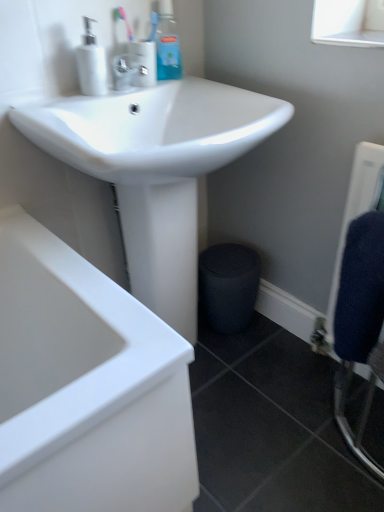
Question: Is white glossy soap dispenser at upper left taller than satin nickel faucet at upper center, placed as the 1th toiletry when sorted from left to right?

Choices:
 (A) yes
 (B) no

Answer: (A)

Question: Is white glossy soap dispenser at upper left facing away from satin nickel faucet at upper center, which appears as the 2th toiletry when viewed from the right?

Choices:
 (A) no
 (B) yes

Answer: (A)

Question: From the image's perspective, is white glossy soap dispenser at upper left on top of satin nickel faucet at upper center, placed as the 1th toiletry when sorted from left to right?

Choices:
 (A) yes
 (B) no

Answer: (B)

Question: From a real-world perspective, does white glossy soap dispenser at upper left sit lower than satin nickel faucet at upper center, which appears as the 2th toiletry when viewed from the right?

Choices:
 (A) yes
 (B) no

Answer: (B)

Question: Is white glossy soap dispenser at upper left aimed at satin nickel faucet at upper center, placed as the 1th toiletry when sorted from left to right?

Choices:
 (A) yes
 (B) no

Answer: (B)

Question: Is white glossy soap dispenser at upper left to the left of satin nickel faucet at upper center, which appears as the 2th toiletry when viewed from the right, from the viewer's perspective?

Choices:
 (A) yes
 (B) no

Answer: (A)

Question: From the image's perspective, is satin nickel faucet at upper center, which appears as the 2th toiletry when viewed from the right, located above dark blue textured towel at right?

Choices:
 (A) yes
 (B) no

Answer: (A)

Question: Is satin nickel faucet at upper center, placed as the 1th toiletry when sorted from left to right, far away from dark blue textured towel at right?

Choices:
 (A) yes
 (B) no

Answer: (B)

Question: Does satin nickel faucet at upper center, which appears as the 2th toiletry when viewed from the right, have a smaller size compared to dark blue textured towel at right?

Choices:
 (A) yes
 (B) no

Answer: (A)

Question: From a real-world perspective, is satin nickel faucet at upper center, placed as the 1th toiletry when sorted from left to right, over dark blue textured towel at right?

Choices:
 (A) yes
 (B) no

Answer: (A)

Question: Is dark blue textured towel at right located within satin nickel faucet at upper center, placed as the 1th toiletry when sorted from left to right?

Choices:
 (A) no
 (B) yes

Answer: (A)

Question: Could you tell me if satin nickel faucet at upper center, placed as the 1th toiletry when sorted from left to right, is facing dark blue textured towel at right?

Choices:
 (A) yes
 (B) no

Answer: (B)

Question: Is white glossy sink at upper center located outside dark blue textured towel at right?

Choices:
 (A) yes
 (B) no

Answer: (A)